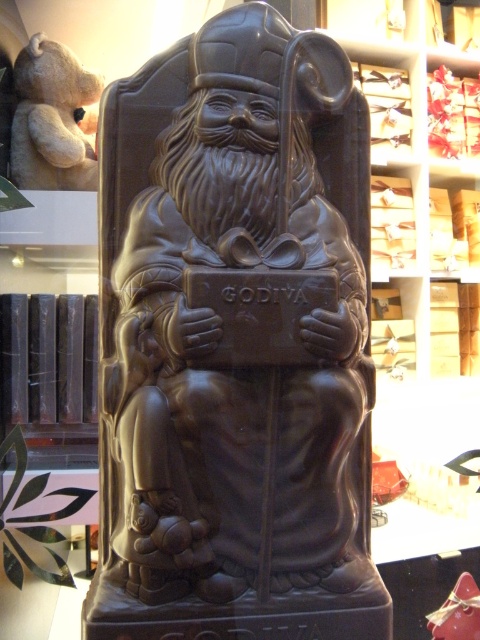
Which is below, matte chocolate sculpture at center or soft beige teddy bear at upper left?

matte chocolate sculpture at center is lower down.

Consider the image. Can you confirm if matte chocolate sculpture at center is positioned above soft beige teddy bear at upper left?

No.

Does point (195, 480) come behind point (43, 92)?

No, it is in front of (43, 92).

The height and width of the screenshot is (640, 480). I want to click on matte chocolate sculpture at center, so click(237, 337).